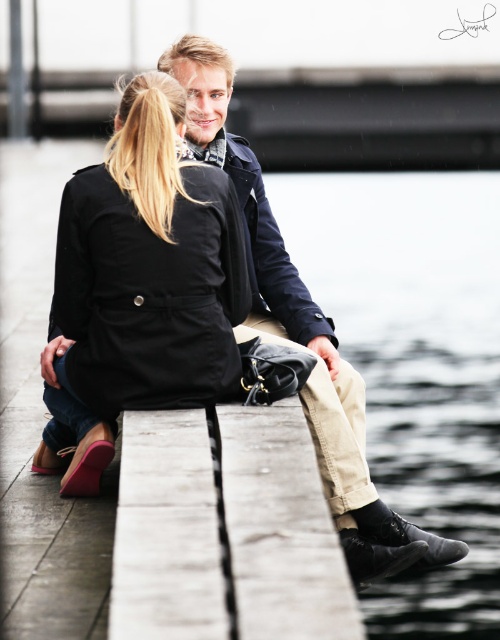
You are a photographer trying to capture a closeup of the black leather shoes at lower center without including the matte black coat at center in the frame. Given their relative widths, is this possible?

The black leather shoes at lower center are wider than the matte black coat at center. Therefore, it is possible to capture a closeup of the black leather shoes at lower center without including the matte black coat at center by focusing on the wider shoes and adjusting the camera angle to exclude the narrower coat.